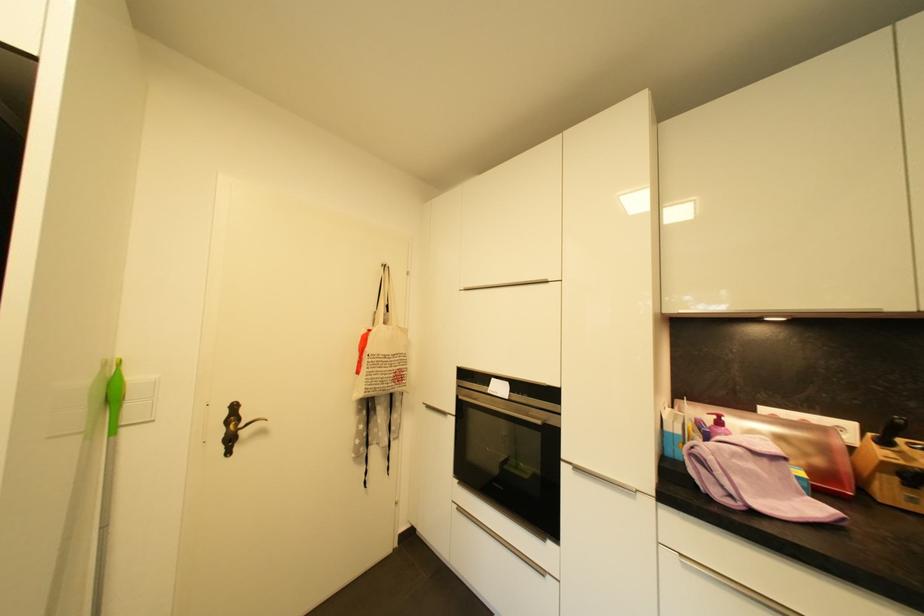
Find the location of a particular element. Image resolution: width=924 pixels, height=616 pixels. purple bottle pump is located at coordinates (718, 426).